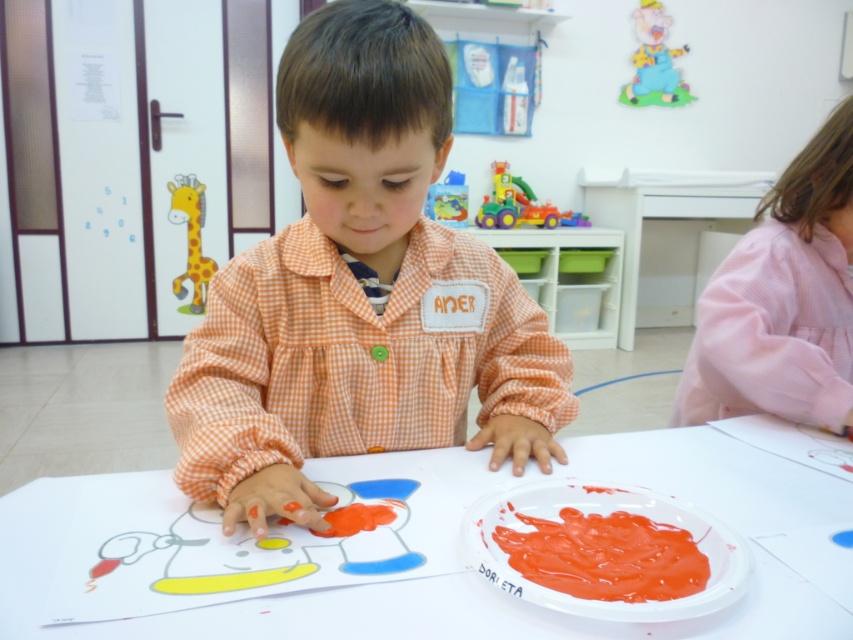
Locate an element on the screen. The height and width of the screenshot is (640, 853). white paper at center is located at coordinates (473, 572).

From the picture: Who is taller, white paper at center or smooth plastic plate at lower center?

white paper at center

Describe the element at coordinates (473, 572) in the screenshot. The image size is (853, 640). I see `white paper at center` at that location.

Locate an element on the screen. This screenshot has height=640, width=853. white paper at center is located at coordinates (473, 572).

Is orange checkered shirt at center wider than translucent plastic bottle at upper center?

Correct, the width of orange checkered shirt at center exceeds that of translucent plastic bottle at upper center.

Is orange checkered shirt at center positioned behind translucent plastic bottle at upper center?

No, it is not.

Is point (207, 476) farther from viewer compared to point (447, 198)?

That is False.

The width and height of the screenshot is (853, 640). In order to click on orange checkered shirt at center in this screenshot , I will do `click(358, 292)`.

Can you confirm if cartoon pig at upper right is positioned above plastic multicolored toy truck at upper center?

Yes.

Who is more distant from viewer, (640, 32) or (485, 204)?

Positioned behind is point (640, 32).

Locate an element on the screen. The width and height of the screenshot is (853, 640). cartoon pig at upper right is located at coordinates (653, 61).